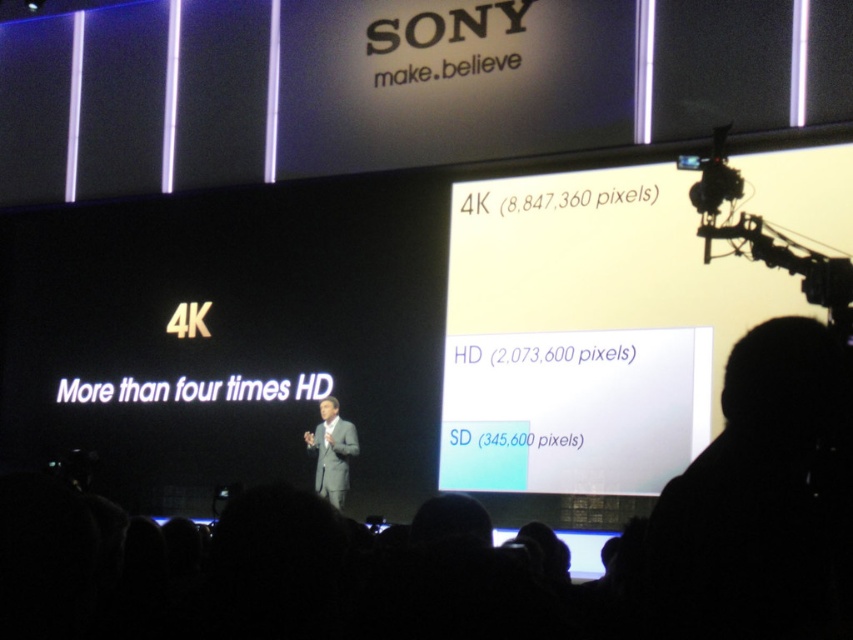
Which is more to the left, black metal video camera at upper right or gray suit at center?

Positioned to the left is gray suit at center.

Is point (834, 260) positioned behind point (331, 396)?

No, (834, 260) is in front of (331, 396).

Measure the distance between black metal video camera at upper right and camera.

A distance of 35.96 meters exists between black metal video camera at upper right and camera.

This screenshot has height=640, width=853. In order to click on black metal video camera at upper right in this screenshot , I will do `click(764, 236)`.